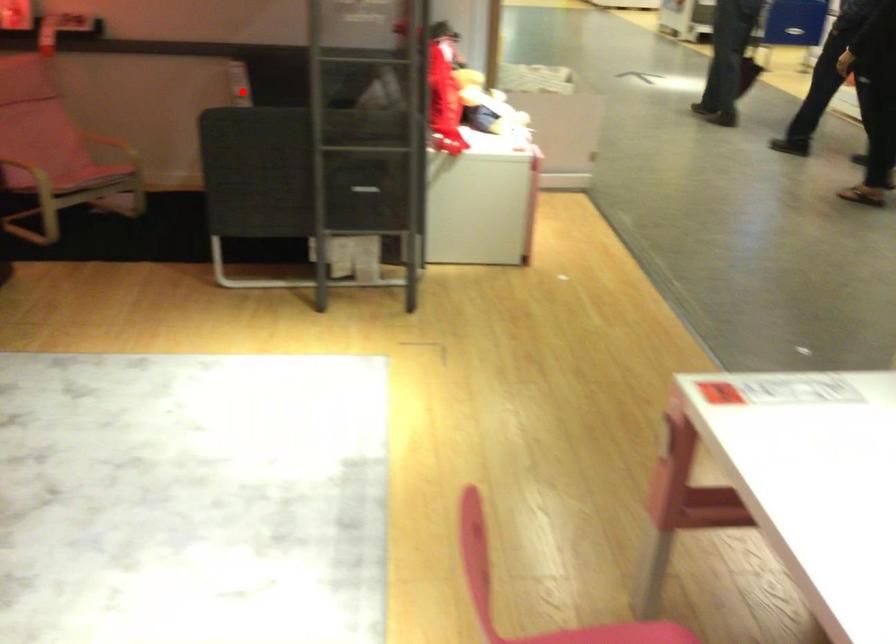
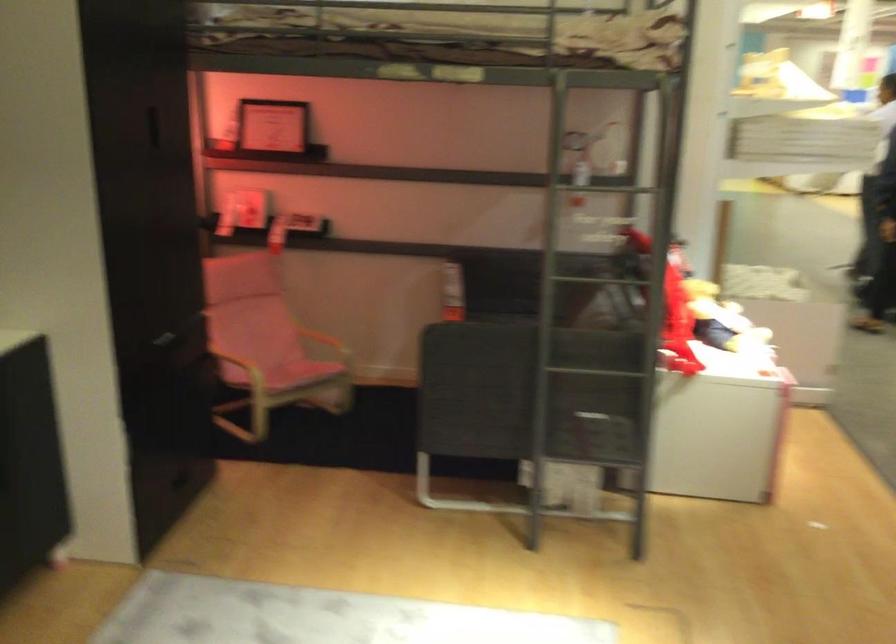
The point at the highlighted location is marked in the first image. Where is the corresponding point in the second image?

(452, 292)